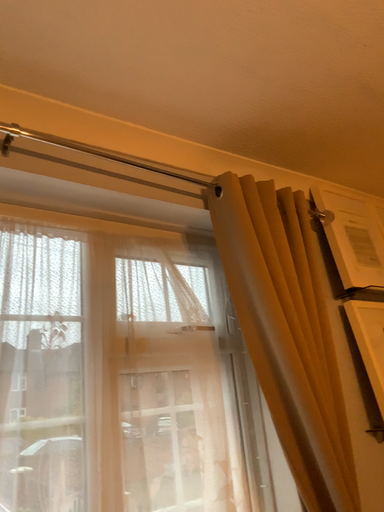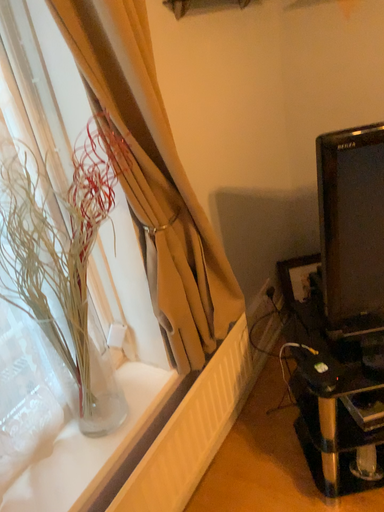
Question: Which way did the camera rotate in the video?

Choices:
 (A) rotated upward
 (B) rotated downward

Answer: (B)